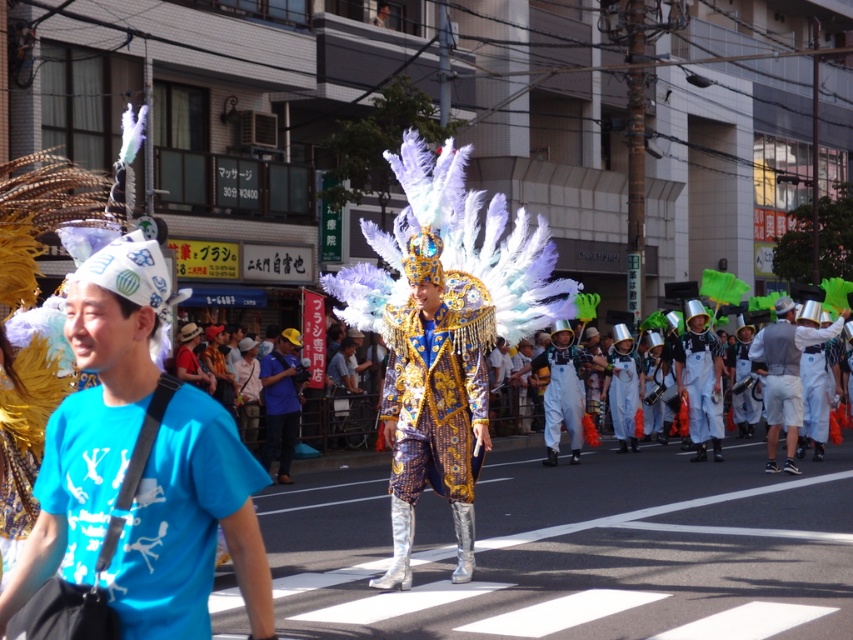
Looking at this image, you are a photographer at the parade and want to capture both the white paper hat at left and the blue fabric hat at center in a single shot. Which hat should you position closer to the left edge of your camera frame to ensure both are visible?

You should position the blue fabric hat at center closer to the left edge of your camera frame because the white paper hat at left is actually located to the right of the blue fabric hat at center, meaning the blue fabric hat is naturally positioned more to the left. By aligning the blue fabric hat at center near the left edge, the white paper hat at left will naturally fall within the frame to its right, ensuring both are captured in the shot.

You are a photographer taking pictures of the parade. You notice the silver metallic helmet at right and the white fabric pants at right. Which one is closer to your camera lens?

The silver metallic helmet at right is closer to the camera lens because it is positioned in front of the white fabric pants at right.

You are a photographer at the parade. You want to take a photo of the performer in the center while ensuring the white paper hat at left is visible in the frame. Based on their positions, what should you do to include both in the shot?

Since the white paper hat at left is located at point (94, 413), you should adjust your camera angle to include both the central performer and the white paper hat at left by framing the shot to cover that coordinate.